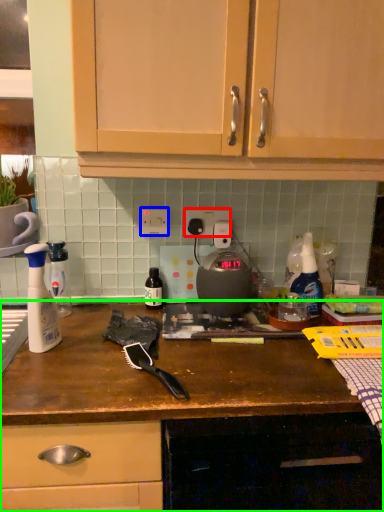
Question: Based on their relative distances, which object is farther from electric outlet (highlighted by a red box)? Choose from electric outlet (highlighted by a blue box) and cabinetry (highlighted by a green box).

Choices:
 (A) electric outlet
 (B) cabinetry

Answer: (B)